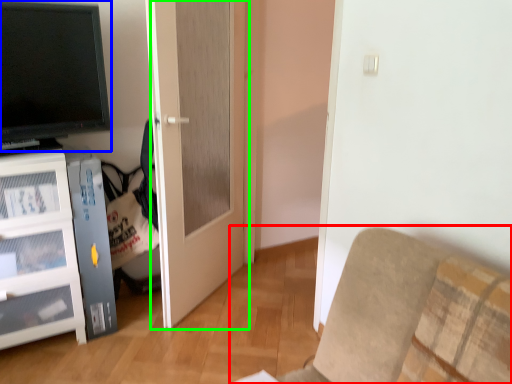
Question: Which is farther away from furniture (highlighted by a red box)? television (highlighted by a blue box) or door (highlighted by a green box)?

Choices:
 (A) television
 (B) door

Answer: (A)